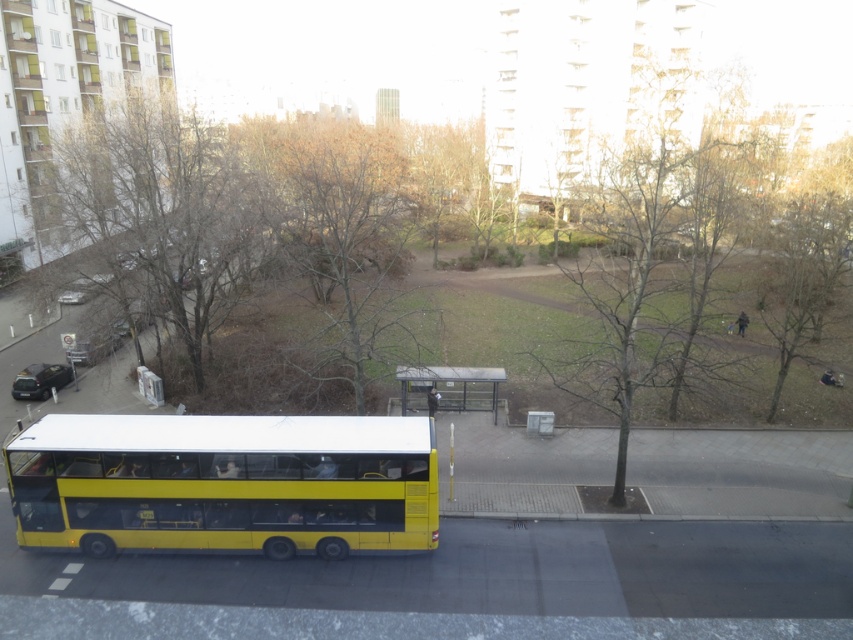
Question: Estimate the real-world distances between objects in this image. Which object is farther from the bare branches at center?

Choices:
 (A) yellow matte bus at lower left
 (B) metallic silver bus stop at center
 (C) brown leafless tree at center

Answer: (B)

Question: Which of the following is the farthest from the observer?

Choices:
 (A) metallic silver bus stop at center
 (B) brown leafless tree at center
 (C) yellow matte bus at lower left
 (D) bare branches at center

Answer: (A)

Question: Is yellow matte bus at lower left above brown leafless tree at center?

Choices:
 (A) no
 (B) yes

Answer: (A)

Question: Considering the real-world distances, which object is closest to the brown leafless tree at center?

Choices:
 (A) yellow matte bus at lower left
 (B) metallic silver bus stop at center
 (C) bare branches at center

Answer: (A)

Question: Does bare branches at center appear on the right side of metallic silver bus stop at center?

Choices:
 (A) yes
 (B) no

Answer: (A)

Question: Can you confirm if bare branches at center is positioned above metallic silver bus stop at center?

Choices:
 (A) yes
 (B) no

Answer: (A)